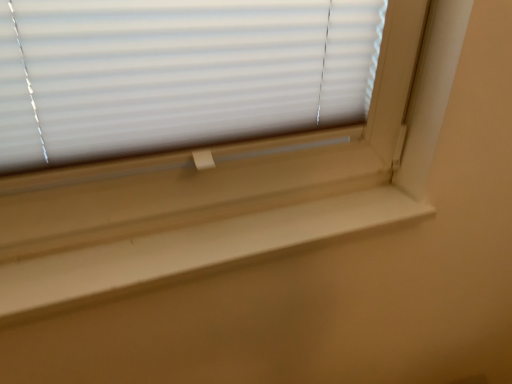
I want to click on white smooth window sill at center, so click(x=191, y=250).

Describe the element at coordinates (191, 250) in the screenshot. This screenshot has width=512, height=384. I see `white smooth window sill at center` at that location.

Locate an element on the screen. The width and height of the screenshot is (512, 384). white matte blinds at upper center is located at coordinates (177, 73).

This screenshot has height=384, width=512. Describe the element at coordinates (177, 73) in the screenshot. I see `white matte blinds at upper center` at that location.

In order to click on white smooth window sill at center in this screenshot , I will do `click(191, 250)`.

Can you confirm if white smooth window sill at center is positioned to the left of white matte blinds at upper center?

Incorrect, white smooth window sill at center is not on the left side of white matte blinds at upper center.

Which object is closer to the camera, white smooth window sill at center or white matte blinds at upper center?

Positioned in front is white matte blinds at upper center.

Considering the positions of points (105, 273) and (140, 102), is point (105, 273) closer to camera compared to point (140, 102)?

No.

From the image's perspective, relative to white matte blinds at upper center, is white smooth window sill at center above or below?

white smooth window sill at center is below white matte blinds at upper center.

From a real-world perspective, is white smooth window sill at center over white matte blinds at upper center?

Incorrect, from a real-world perspective, white smooth window sill at center is lower than white matte blinds at upper center.

Considering the relative sizes of white smooth window sill at center and white matte blinds at upper center in the image provided, is white smooth window sill at center wider than white matte blinds at upper center?

Yes, white smooth window sill at center is wider than white matte blinds at upper center.

Can you confirm if white smooth window sill at center is shorter than white matte blinds at upper center?

Yes, white smooth window sill at center is shorter than white matte blinds at upper center.

Considering the sizes of objects white smooth window sill at center and white matte blinds at upper center in the image provided, who is smaller, white smooth window sill at center or white matte blinds at upper center?

With smaller size is white matte blinds at upper center.

Is white smooth window sill at center completely or partially outside of white matte blinds at upper center?

Yes, white smooth window sill at center is outside of white matte blinds at upper center.

Is white smooth window sill at center with white matte blinds at upper center?

No, white smooth window sill at center is not in contact with white matte blinds at upper center.

Consider the image. Is white smooth window sill at center turned away from white matte blinds at upper center?

white smooth window sill at center does not have its back to white matte blinds at upper center.

Locate an element on the screen. This screenshot has width=512, height=384. window sill below the white matte blinds at upper center (from a real-world perspective) is located at coordinates (191, 250).

Can you confirm if white matte blinds at upper center is positioned to the right of white smooth window sill at center?

No.

Does white matte blinds at upper center come behind white smooth window sill at center?

No, white matte blinds at upper center is closer to the camera.

Is point (322, 10) closer to camera compared to point (329, 210)?

Yes.

From the image's perspective, is white matte blinds at upper center above or below white smooth window sill at center?

Based on their image positions, white matte blinds at upper center is located above white smooth window sill at center.

From a real-world perspective, who is located higher, white matte blinds at upper center or white smooth window sill at center?

white matte blinds at upper center is physically above.

Between white matte blinds at upper center and white smooth window sill at center, which one has smaller width?

white matte blinds at upper center is thinner.

Who is taller, white matte blinds at upper center or white smooth window sill at center?

Standing taller between the two is white matte blinds at upper center.

Considering the relative sizes of white matte blinds at upper center and white smooth window sill at center in the image provided, is white matte blinds at upper center smaller than white smooth window sill at center?

Yes.

Is white matte blinds at upper center located outside white smooth window sill at center?

Indeed, white matte blinds at upper center is completely outside white smooth window sill at center.

Is white matte blinds at upper center placed right next to white smooth window sill at center?

white matte blinds at upper center is not next to white smooth window sill at center, and they're not touching.

Is white matte blinds at upper center facing away from white smooth window sill at center?

No.

This screenshot has width=512, height=384. I want to click on window blind above the white smooth window sill at center (from the image's perspective), so click(177, 73).

This screenshot has width=512, height=384. Find the location of `window sill that appears on the right of white matte blinds at upper center`. window sill that appears on the right of white matte blinds at upper center is located at coordinates (191, 250).

At what (x,y) coordinates should I click in order to perform the action: click on window blind in front of the white smooth window sill at center. Please return your answer as a coordinate pair (x, y). Image resolution: width=512 pixels, height=384 pixels. Looking at the image, I should click on (177, 73).